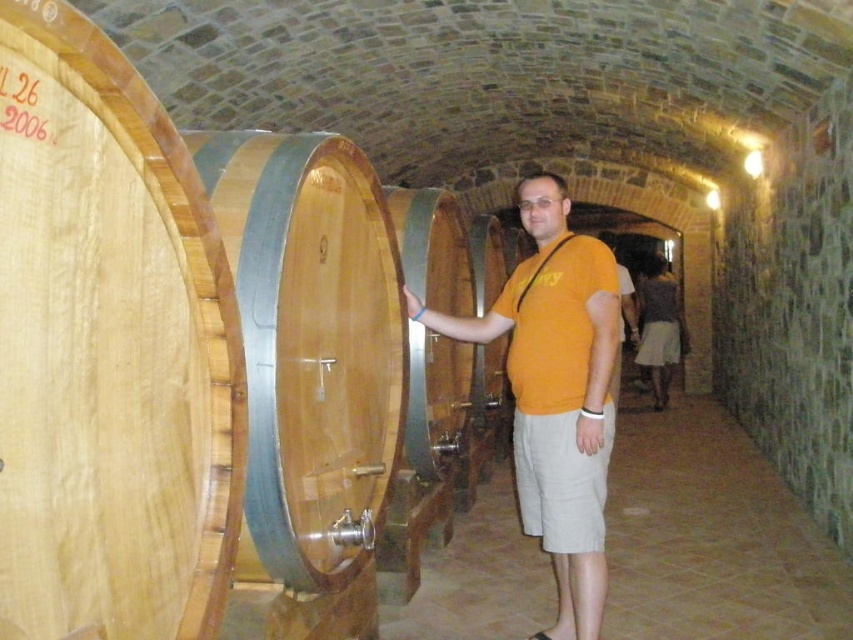
Question: Can you confirm if orange cotton shirt at center is smaller than wooden barrel at center?

Choices:
 (A) no
 (B) yes

Answer: (B)

Question: Is natural wood barrel at center behind orange cotton shirt at center?

Choices:
 (A) yes
 (B) no

Answer: (B)

Question: Which object appears farthest from the camera in this image?

Choices:
 (A) natural wood barrel at left
 (B) orange cotton shirt at center

Answer: (B)

Question: Which point is farther to the camera?

Choices:
 (A) natural wood barrel at left
 (B) wooden barrel at center
 (C) natural wood barrel at center

Answer: (B)

Question: Which of the following is the farthest from the observer?

Choices:
 (A) (126, 365)
 (B) (567, 483)
 (C) (456, 406)

Answer: (C)

Question: Is natural wood barrel at left below orange cotton shirt at center?

Choices:
 (A) yes
 (B) no

Answer: (B)